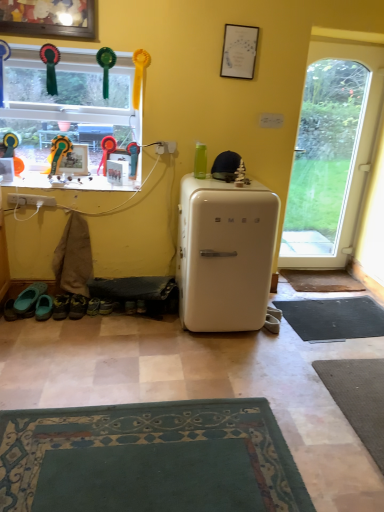
What are the coordinates of `vacant area on top of white matte refrigerator at center (from a real-world perspective)` in the screenshot? It's located at (225, 184).